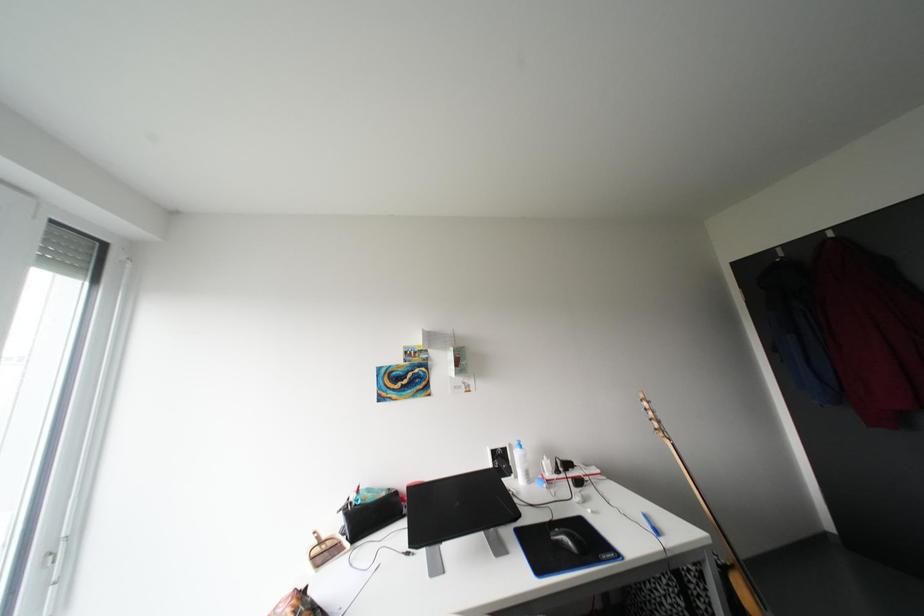
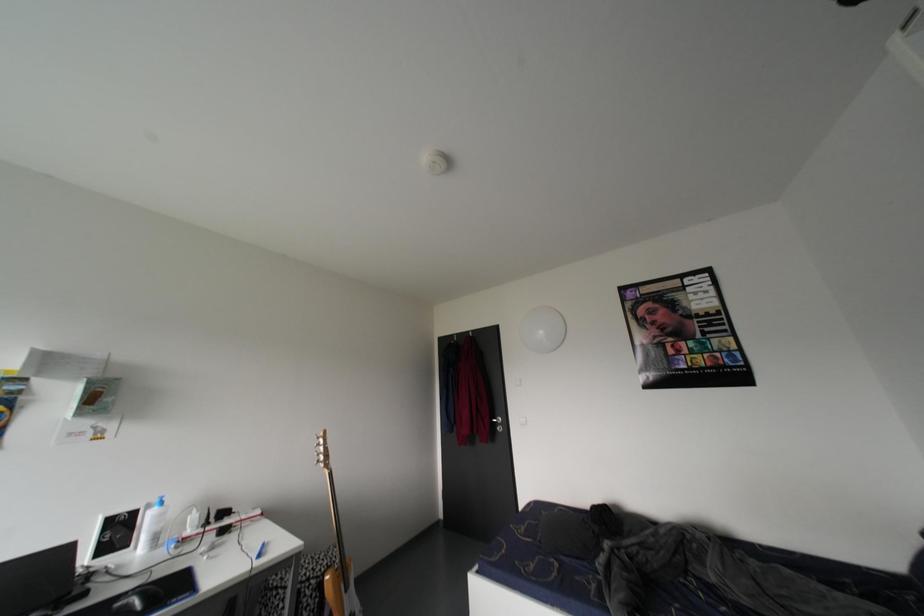
Question: The camera is either moving clockwise (left) or counter-clockwise (right) around the object. The first image is from the beginning of the video and the second image is from the end. Is the camera moving left or right when shooting the video?

Choices:
 (A) Left
 (B) Right

Answer: (A)